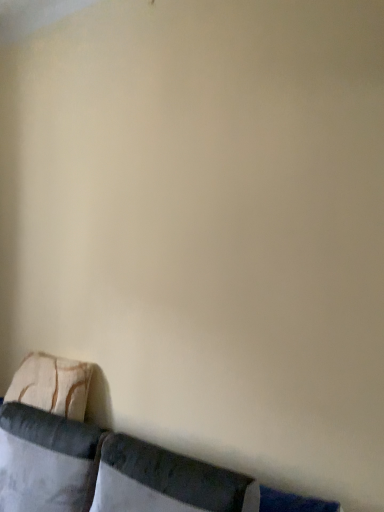
Question: Considering the positions of velvet cushion at lower left and white fabric pillow at lower left, which appears as the 2th pillow when viewed from the back, in the image, is velvet cushion at lower left bigger or smaller than white fabric pillow at lower left, which appears as the 2th pillow when viewed from the back,?

Choices:
 (A) big
 (B) small

Answer: (A)

Question: From the image's perspective, is velvet cushion at lower left positioned above or below white fabric pillow at lower left, the second pillow in the front-to-back sequence?

Choices:
 (A) above
 (B) below

Answer: (B)

Question: Estimate the real-world distances between objects in this image. Which object is closer to the white fabric pillow at lower left, which appears as the 2th pillow when viewed from the back?

Choices:
 (A) velvet cushion at lower left
 (B) textured beige pillow at lower left, the first pillow from the back
 (C) velvet dark gray pillow at lower center, arranged as the first pillow when viewed from the front

Answer: (A)

Question: Which object is positioned farthest from the white fabric pillow at lower left, the second pillow in the front-to-back sequence?

Choices:
 (A) textured beige pillow at lower left, marked as the third pillow in a front-to-back arrangement
 (B) velvet cushion at lower left
 (C) velvet dark gray pillow at lower center, which ranks as the 3th pillow in back-to-front order

Answer: (C)